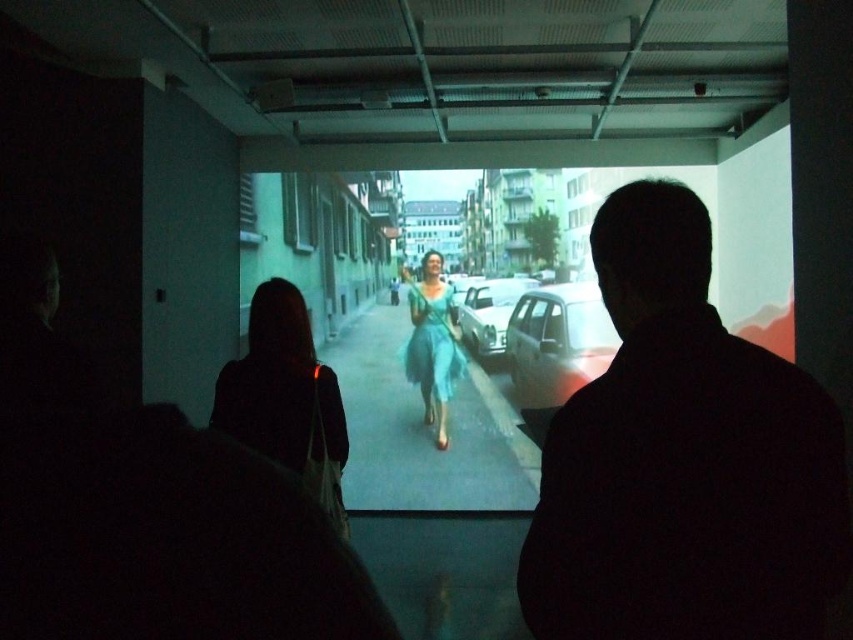
Is black matte man at right shorter than shiny silver car at center?

Incorrect, black matte man at right's height does not fall short of shiny silver car at center's.

This screenshot has height=640, width=853. In order to click on black matte man at right in this screenshot , I will do `click(683, 460)`.

This screenshot has width=853, height=640. I want to click on black matte man at right, so [683, 460].

Is teal tulle dress at center smaller than shiny silver car at center?

No.

At what (x,y) coordinates should I click in order to perform the action: click on teal tulle dress at center. Please return your answer as a coordinate pair (x, y). Looking at the image, I should click on (286, 397).

Is black matte man at right to the left of teal satin dress at center from the viewer's perspective?

In fact, black matte man at right is to the right of teal satin dress at center.

Between point (747, 355) and point (410, 296), which one is positioned behind?

The point (410, 296) is more distant.

You are a GUI agent. You are given a task and a screenshot of the screen. Output one action in this format:
    pyautogui.click(x=<x>, y=<y>)
    Task: Click on the black matte man at right
    
    Given the screenshot: What is the action you would take?
    pyautogui.click(x=683, y=460)